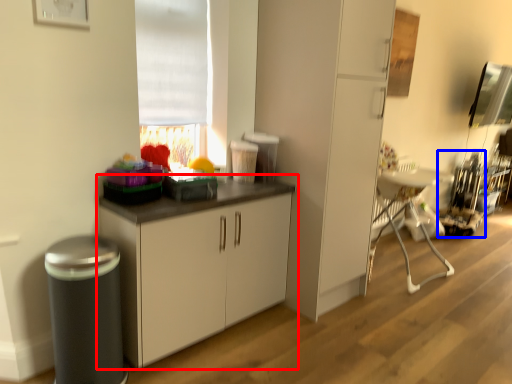
Question: Which object is closer to the camera taking this photo, cabinetry (highlighted by a red box) or appliance (highlighted by a blue box)?

Choices:
 (A) cabinetry
 (B) appliance

Answer: (A)